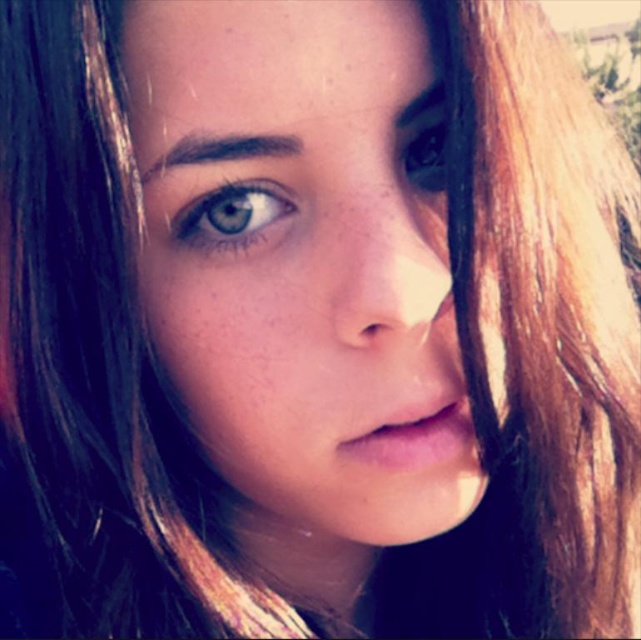
You are a photographer adjusting the focus on a camera. You notice two elements in the image you captured. The smooth skin face at center and the blue glossy eye at center. Which element is in focus and closer to the camera?

The smooth skin face at center is closer to the viewer than the blue glossy eye at center, so the smooth skin face at center is in focus.

You are a photographer adjusting the focus of a portrait. You have two points in the image to consider for sharpness. The first is at point (304, 323), and the second is at point (428, 148). Given the scene described, which point should you focus on to ensure the subject is in focus?

You should focus on point (304, 323) because it is closer to the viewer than point (428, 148), ensuring the subject is in focus.

From the picture: You are a photographer adjusting the lighting for a portrait. You notice the smooth skin face at center and the shiny brown eye at upper right. Which object is more to the left in the frame?

The smooth skin face at center is positioned on the left side of the shiny brown eye at upper right, so it is more to the left.